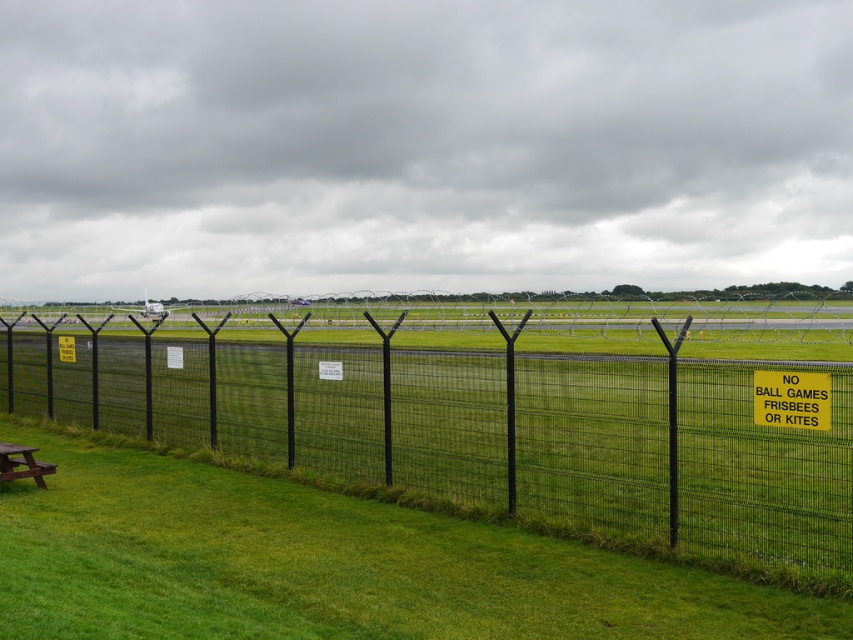
Question: Is black wire mesh fence at center wider than yellow plastic sign at center right?

Choices:
 (A) yes
 (B) no

Answer: (A)

Question: Can you confirm if black wire mesh fence at center is positioned below brown wooden picnic table at lower left?

Choices:
 (A) yes
 (B) no

Answer: (B)

Question: Does black wire mesh fence at center have a greater width compared to yellow plastic sign at center right?

Choices:
 (A) yes
 (B) no

Answer: (A)

Question: Which of these objects is positioned farthest from the yellow plastic sign at center right?

Choices:
 (A) black wire mesh fence at center
 (B) brown wooden picnic table at lower left

Answer: (B)

Question: Which point is farther to the camera?

Choices:
 (A) (47, 465)
 (B) (815, 406)
 (C) (514, 513)

Answer: (A)

Question: Which point is closer to the camera taking this photo?

Choices:
 (A) (759, 378)
 (B) (815, 563)
 (C) (45, 468)

Answer: (B)